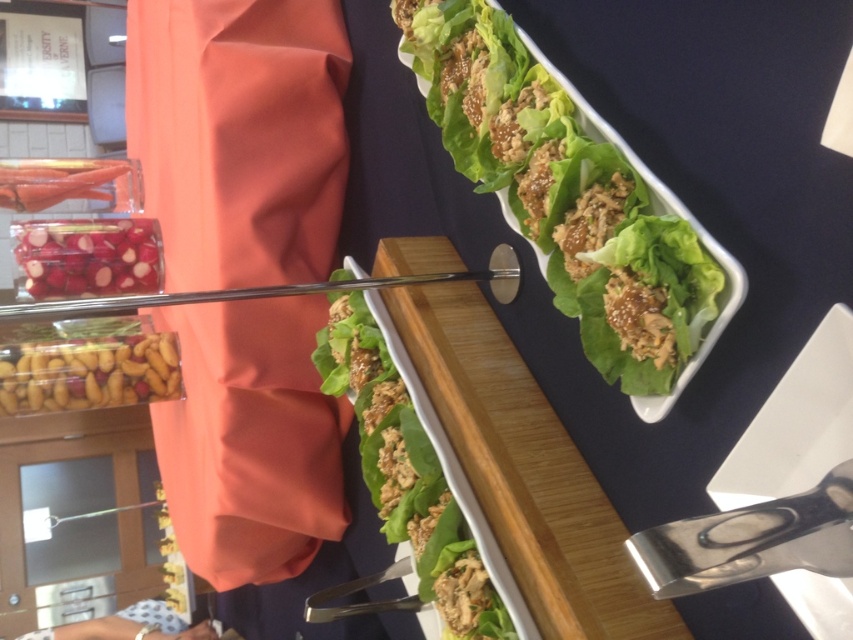
Consider the image. You are at a buffet and want to grab a lettuce wrap. The green leafy lettuce at center is located at point (407, 472). If you move directly towards the lettuce, will you walk into the tray holding the lettuce wraps?

The green leafy lettuce at center is represented by point (407, 472), so moving directly towards it would lead you to the lettuce itself, not the tray. However, since the lettuce is part of the lettuce wraps on the tray, you would approach the tray holding the lettuce wraps.

You are at a buffet and need to grab a lettuce wrap. You see the green leafy lettuce at center and the translucent plastic container at lower left. Which item is located to the right of the other?

The green leafy lettuce at center is positioned on the right side of the translucent plastic container at lower left.

You are at a buffet and want to grab the smooth red radish at left but there is a glossy plastic bag at upper left above it. Can you reach the radish without moving the bag?

The smooth red radish at left is positioned under the glossy plastic bag at upper left, so you can reach it without moving the bag as it is accessible from below.